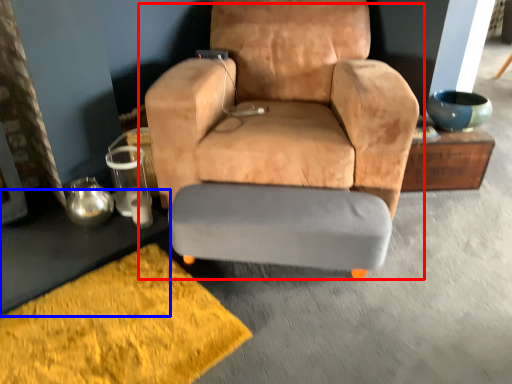
Question: Among these objects, which one is farthest to the camera, chair (highlighted by a red box) or table (highlighted by a blue box)?

Choices:
 (A) chair
 (B) table

Answer: (B)